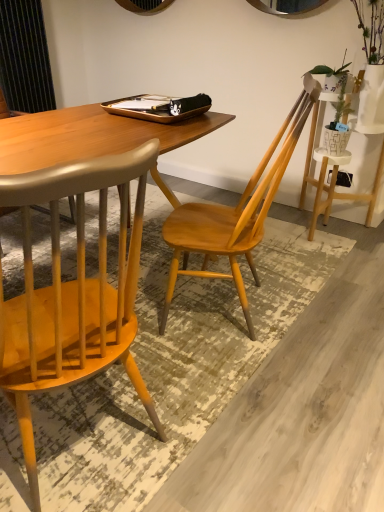
Question: From a real-world perspective, is wooden chair at left, which is counted as the first chair, starting from the left, on light wood chair at center, the first chair from the right?

Choices:
 (A) no
 (B) yes

Answer: (B)

Question: Is light wood chair at center, the second chair in the left-to-right sequence, at the back of wooden chair at left, which is counted as the first chair, starting from the left?

Choices:
 (A) no
 (B) yes

Answer: (A)

Question: Is the surface of wooden chair at left, which is counted as the first chair, starting from the left, in direct contact with light wood chair at center, the second chair in the left-to-right sequence?

Choices:
 (A) no
 (B) yes

Answer: (A)

Question: Does wooden chair at left, positioned as the 2th chair in right-to-left order, have a lesser width compared to light wood chair at center, the first chair from the right?

Choices:
 (A) yes
 (B) no

Answer: (B)

Question: Is wooden chair at left, which is counted as the first chair, starting from the left, taller than light wood chair at center, the second chair in the left-to-right sequence?

Choices:
 (A) no
 (B) yes

Answer: (A)

Question: From the image's perspective, is wooden chair at left, positioned as the 2th chair in right-to-left order, above light wood chair at center, the second chair in the left-to-right sequence?

Choices:
 (A) yes
 (B) no

Answer: (B)

Question: Does light wood chair at center, the first chair from the right, come in front of wooden chair at left, which is counted as the first chair, starting from the left?

Choices:
 (A) yes
 (B) no

Answer: (B)

Question: From the image's perspective, is light wood chair at center, the first chair from the right, beneath wooden chair at left, positioned as the 2th chair in right-to-left order?

Choices:
 (A) no
 (B) yes

Answer: (A)

Question: Is light wood chair at center, the second chair in the left-to-right sequence, smaller than wooden chair at left, positioned as the 2th chair in right-to-left order?

Choices:
 (A) yes
 (B) no

Answer: (A)

Question: Is light wood chair at center, the second chair in the left-to-right sequence, shorter than wooden chair at left, which is counted as the first chair, starting from the left?

Choices:
 (A) yes
 (B) no

Answer: (B)

Question: Does light wood chair at center, the second chair in the left-to-right sequence, have a larger size compared to wooden chair at left, which is counted as the first chair, starting from the left?

Choices:
 (A) no
 (B) yes

Answer: (A)

Question: Is light wood chair at center, the second chair in the left-to-right sequence, beside wooden chair at left, positioned as the 2th chair in right-to-left order?

Choices:
 (A) no
 (B) yes

Answer: (A)

Question: Considering the positions of wooden chair at left, positioned as the 2th chair in right-to-left order, and light wood chair at center, the second chair in the left-to-right sequence, in the image, is wooden chair at left, positioned as the 2th chair in right-to-left order, taller or shorter than light wood chair at center, the second chair in the left-to-right sequence,?

Choices:
 (A) short
 (B) tall

Answer: (A)